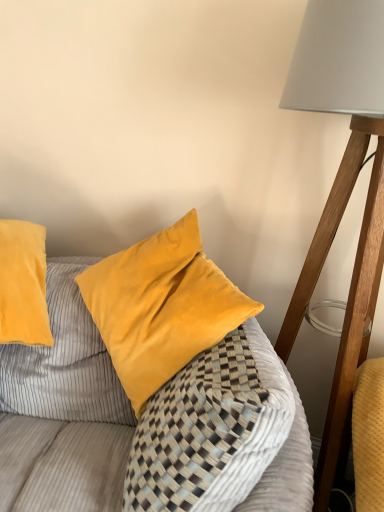
Question: Choose the correct answer: Is velvet yellow pillow at center inside matte white lampshade at right or outside it?

Choices:
 (A) inside
 (B) outside

Answer: (B)

Question: Considering the positions of velvet yellow pillow at center and matte white lampshade at right in the image, is velvet yellow pillow at center bigger or smaller than matte white lampshade at right?

Choices:
 (A) small
 (B) big

Answer: (A)

Question: Is velvet yellow pillow at center in front of or behind matte white lampshade at right in the image?

Choices:
 (A) behind
 (B) front

Answer: (B)

Question: Does point (380, 263) appear closer or farther from the camera than point (54, 503)?

Choices:
 (A) closer
 (B) farther

Answer: (A)

Question: Considering their positions, is matte white lampshade at right located in front of or behind velvet yellow pillow at center?

Choices:
 (A) behind
 (B) front

Answer: (A)

Question: Considering the positions of matte white lampshade at right and velvet yellow pillow at center in the image, is matte white lampshade at right wider or thinner than velvet yellow pillow at center?

Choices:
 (A) wide
 (B) thin

Answer: (A)

Question: From the image's perspective, relative to velvet yellow pillow at center, is matte white lampshade at right above or below?

Choices:
 (A) above
 (B) below

Answer: (A)